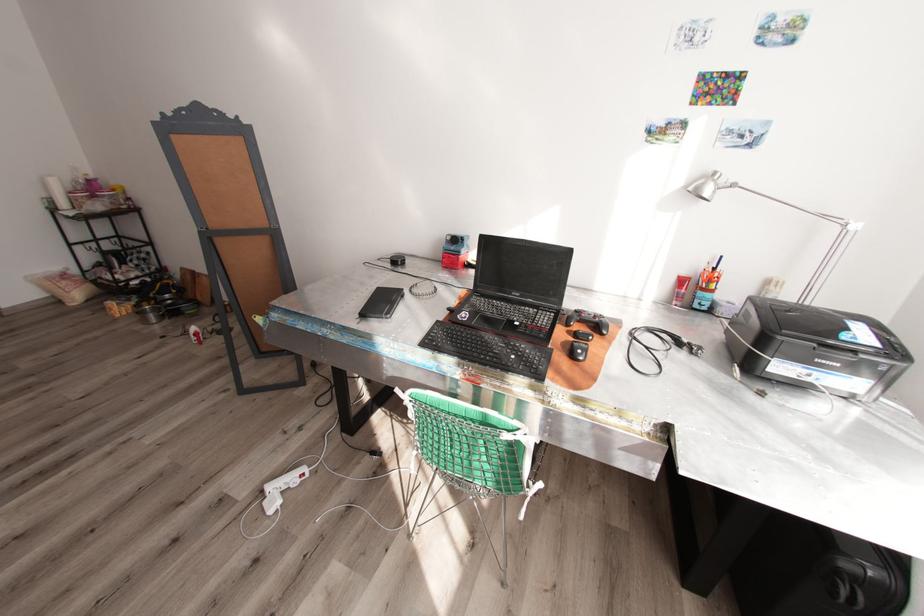
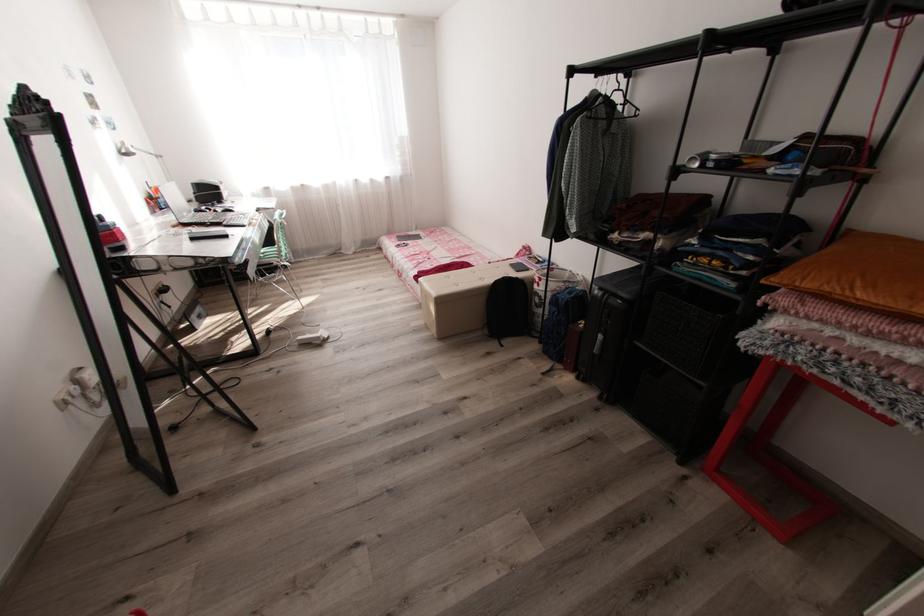
In the second image, find the point that corresponds to (x=369, y=315) in the first image.

(232, 236)